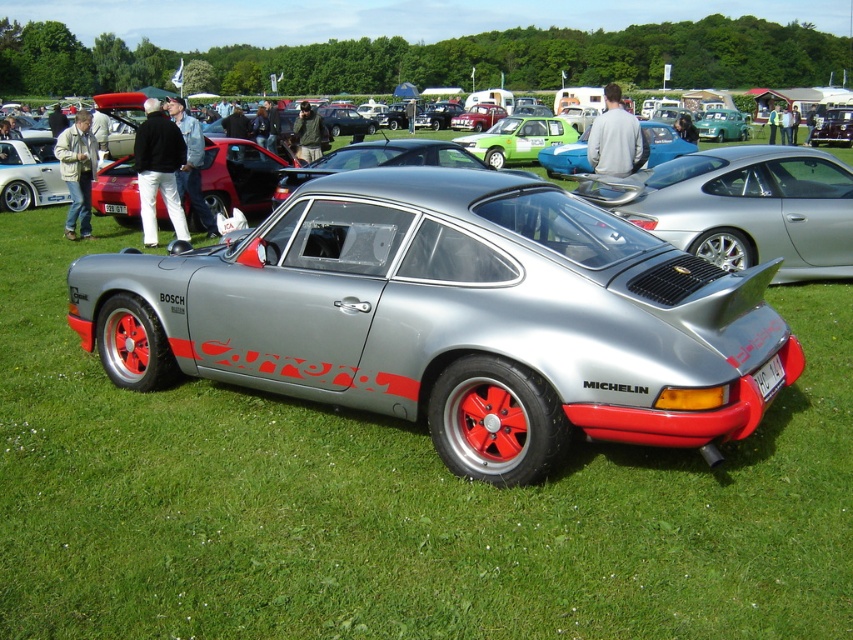
You are a photographer standing at the edge of the grassy field where the car show is taking place. You want to take a photo of both the satin metallic car at center and the green matte hatchback at center in the same frame. Given that your camera has a maximum focal length that allows capturing objects within a 70 feet distance, will you be able to include both cars in a single shot?

The satin metallic car at center is 68.77 feet from the green matte hatchback at center. Since the distance between them is within the camera maximum focal length of 70 feet, you can include both cars in a single shot.

You are standing in front of the Porsche 911 Carrera at the car show. You notice two points marked on the car. The first point is at coordinate point (349, 257) and the second point is at coordinate point (553, 172). Which of these two points is closer to you?

Point (349, 257) is closer to you than point (553, 172).